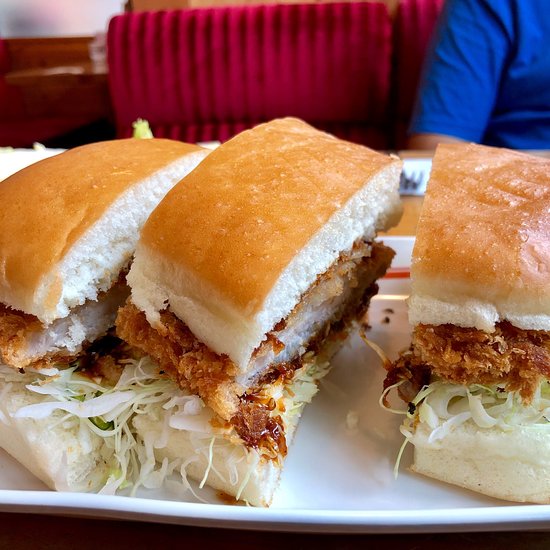
Locate an element on the screen. The height and width of the screenshot is (550, 550). back booth cushion is located at coordinates pyautogui.click(x=320, y=70), pyautogui.click(x=418, y=49).